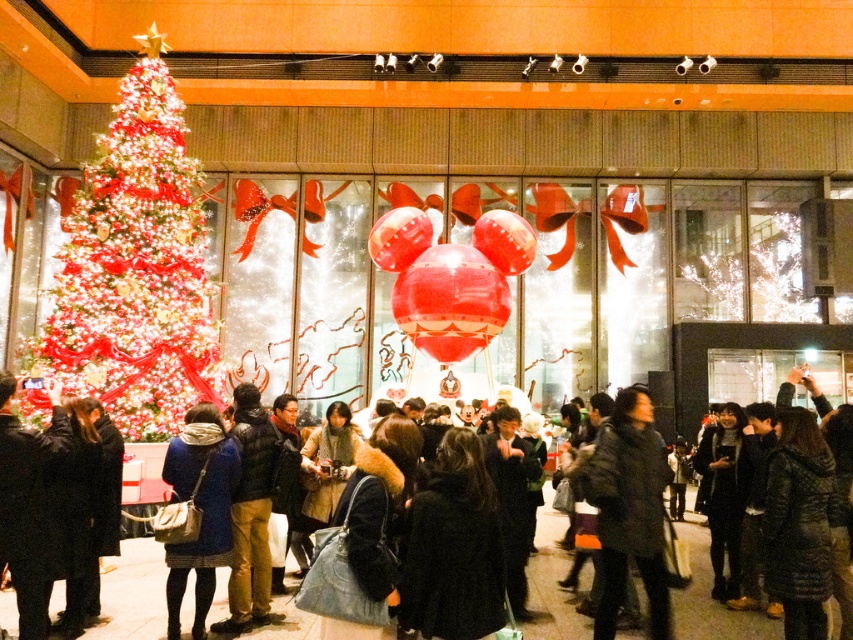
Which is more to the right, black wool coat at center or dark blue coat at center?

black wool coat at center is more to the right.

In the scene shown: Who is more distant from viewer, (x=114, y=618) or (x=6, y=484)?

The point (x=114, y=618) is behind.

Is point (543, 509) farther from camera compared to point (10, 454)?

That is True.

You are a GUI agent. You are given a task and a screenshot of the screen. Output one action in this format:
    pyautogui.click(x=<x>, y=<y>)
    Task: Click on the black wool coat at center
    
    Given the screenshot: What is the action you would take?
    pyautogui.click(x=132, y=593)

Between iridescent glass christmas tree at left and black wool coat at center, which one is positioned lower?

black wool coat at center is below.

This screenshot has height=640, width=853. What do you see at coordinates (135, 268) in the screenshot?
I see `iridescent glass christmas tree at left` at bounding box center [135, 268].

Where is `iridescent glass christmas tree at left`? iridescent glass christmas tree at left is located at coordinates (135, 268).

Looking at this image, does black fuzzy coat at center appear over dark blue coat at center?

No.

In the scene shown: Is black fuzzy coat at center further to camera compared to dark blue coat at center?

Yes, it is.

Where is `black fuzzy coat at center`? The width and height of the screenshot is (853, 640). black fuzzy coat at center is located at coordinates (630, 509).